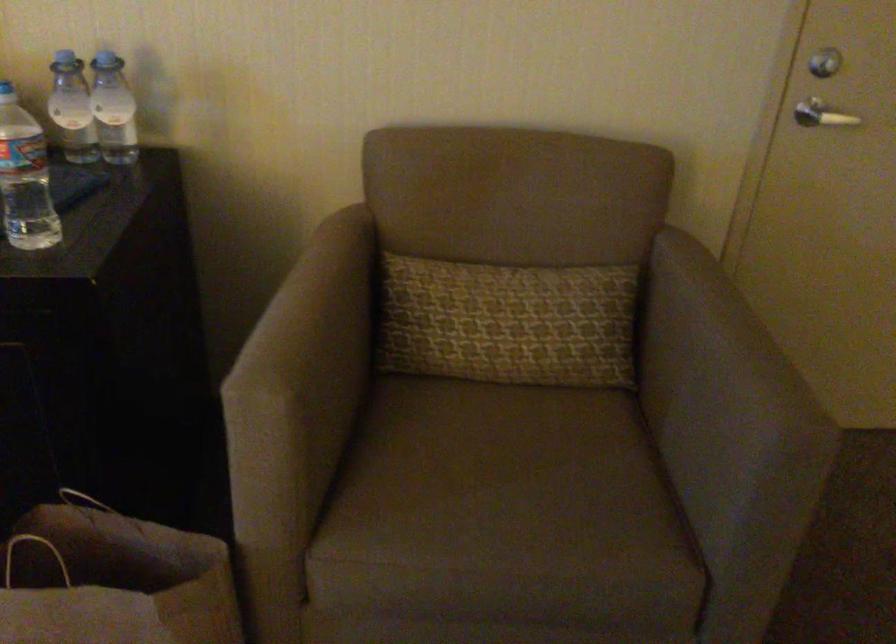
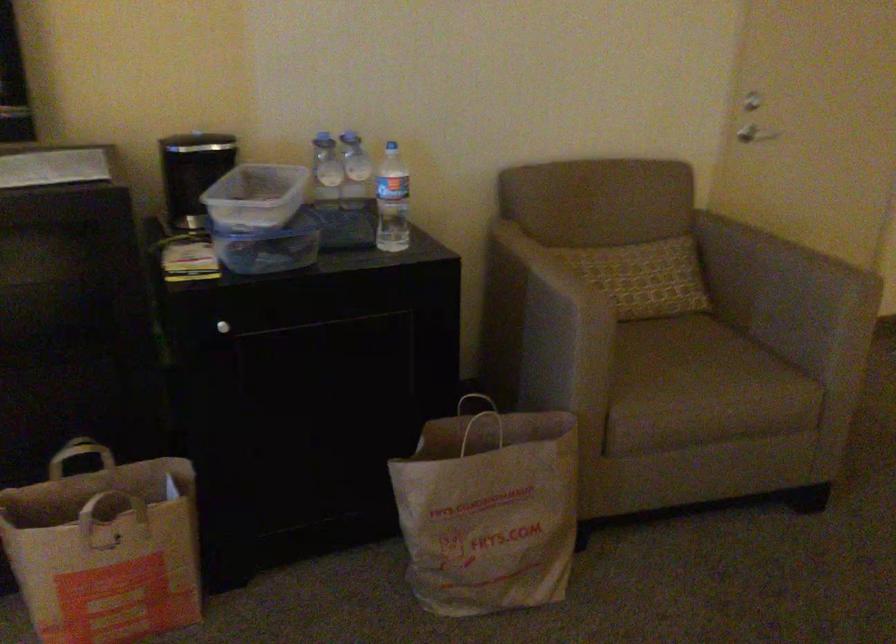
Locate, in the second image, the point that corresponds to point 113,109 in the first image.

(355, 171)